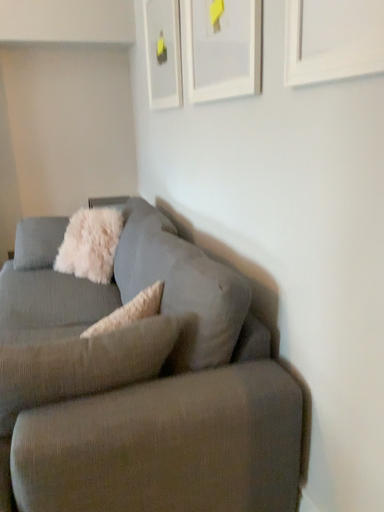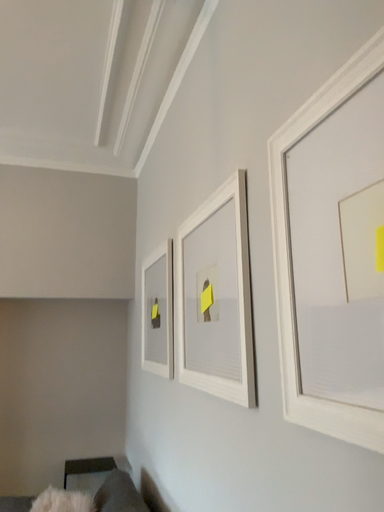
Question: How did the camera likely rotate when shooting the video?

Choices:
 (A) rotated downward
 (B) rotated upward

Answer: (B)